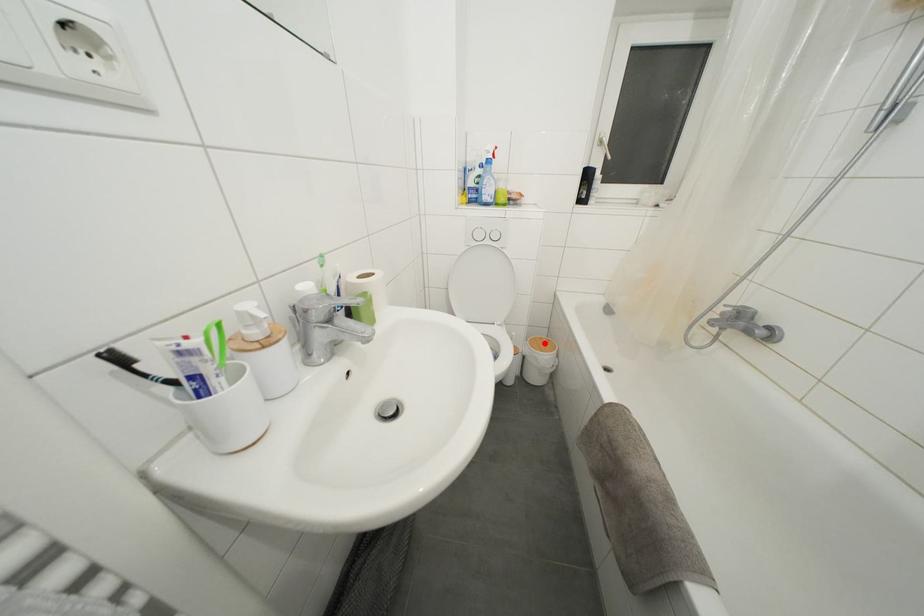
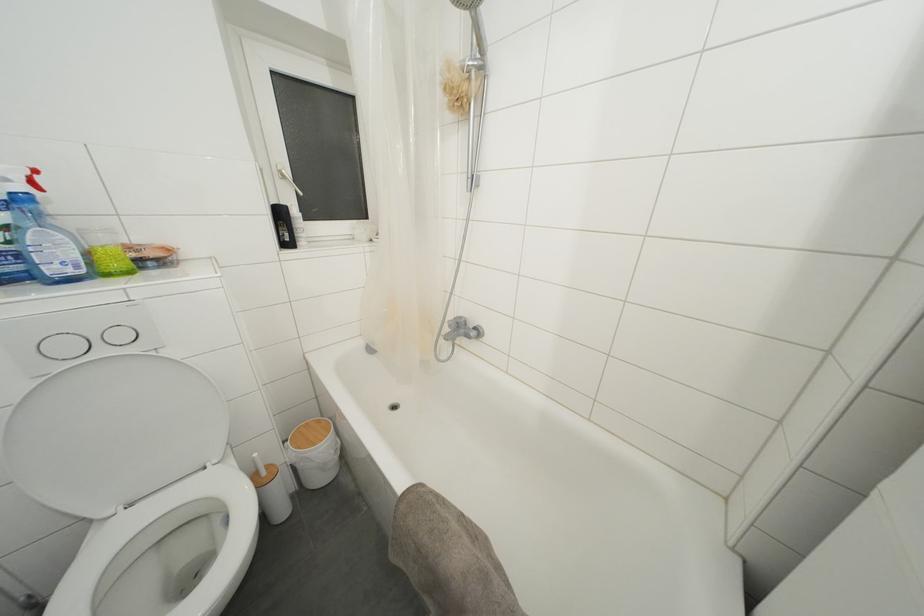
The point at the highlighted location is marked in the first image. Where is the corresponding point in the second image?

(310, 429)